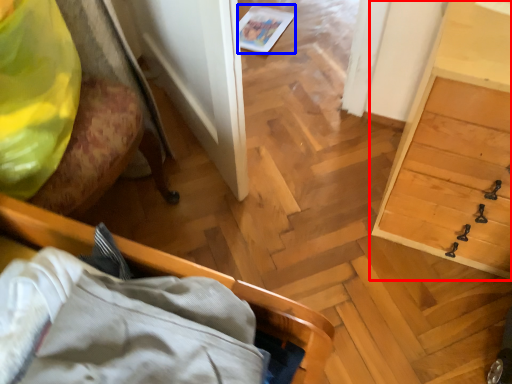
Question: Which of the following is the farthest to the observer, dresser (highlighted by a red box) or magazine (highlighted by a blue box)?

Choices:
 (A) dresser
 (B) magazine

Answer: (B)